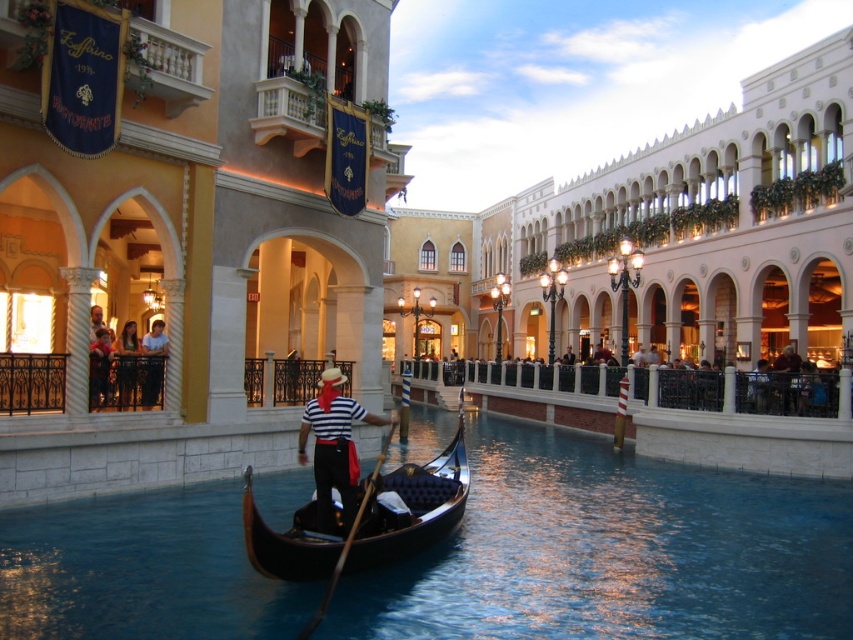
Question: Which point is farther to the camera?

Choices:
 (A) black polished gondola at center
 (B) matte black striped shirt at center
 (C) black glossy water at center

Answer: (B)

Question: Can you confirm if black glossy water at center is positioned to the right of matte black gondolier at center?

Choices:
 (A) yes
 (B) no

Answer: (A)

Question: Is white cotton shirt at center to the right of matte black gondolier at center from the viewer's perspective?

Choices:
 (A) no
 (B) yes

Answer: (A)

Question: Which of the following is the farthest from the observer?

Choices:
 (A) matte black striped shirt at center
 (B) matte black gondolier at center
 (C) black polished gondola at center

Answer: (B)

Question: Does black polished gondola at center appear under matte black striped shirt at center?

Choices:
 (A) yes
 (B) no

Answer: (A)

Question: Which point is closer to the camera?

Choices:
 (A) (347, 492)
 (B) (154, 346)

Answer: (A)